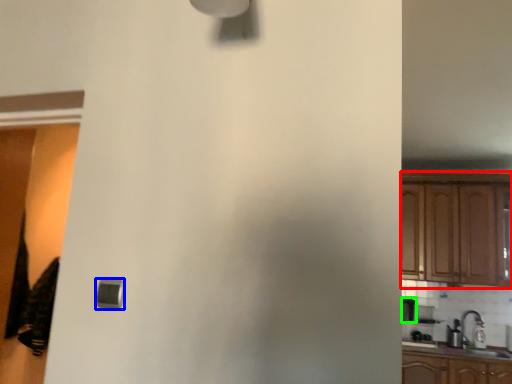
Question: Which object is the farthest from cabinetry (highlighted by a red box)? Choose among these: light (highlighted by a blue box) or appliance (highlighted by a green box).

Choices:
 (A) light
 (B) appliance

Answer: (A)